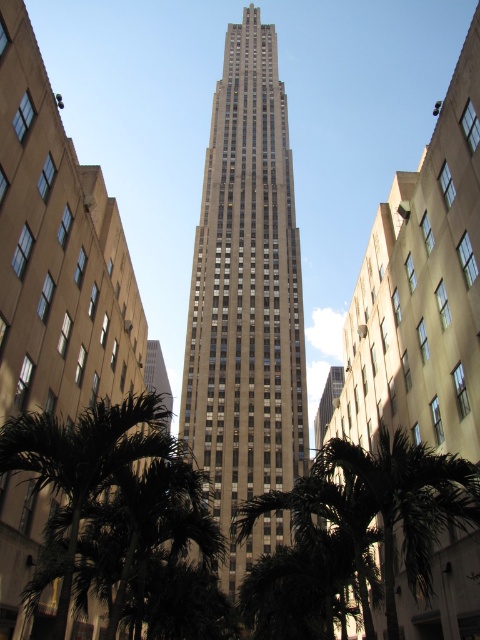
You are a city planner evaluating the urban layout. Based on the scene, which object occupies a more prominent position in the image, the gray stone skyscraper at center or the green leafy palm tree at lower left?

The gray stone skyscraper at center is larger in size than the green leafy palm tree at lower left, making it the more prominent object in the image.

You are standing at the edge of a park across from the gray stone skyscraper at center. You want to take a photo of the entire building without any obstructions. Considering the skyscraper is 264.38 feet away from you, what is the minimum focal length lens you should use if your camera sensor has a diagonal measurement of 24mm? Assume the skyscraper is 1200 feet tall and the lens follows the formula focal_length_mm 1.5 x sensor_diagonal_mm x distance_ft height_ft.

Using the formula provided, the minimum focal length lens required is calculated as follows. Plugging in the values, focal_length_mm 1.5 x 24mm x 264.38 feet 1200 feet. This results in a focal length of approximately 8.5mm. However, since standard lenses typically start at 16mm, you might need to use a 16mm lens to ensure the entire skyscraper fits within the frame.

You are a city planner assessing the impact of new construction. You notice the gray stone skyscraper at center and the green leafy palm tree at center in the scene. Which one is significantly taller?

The gray stone skyscraper at center is much taller than the green leafy palm tree at center.